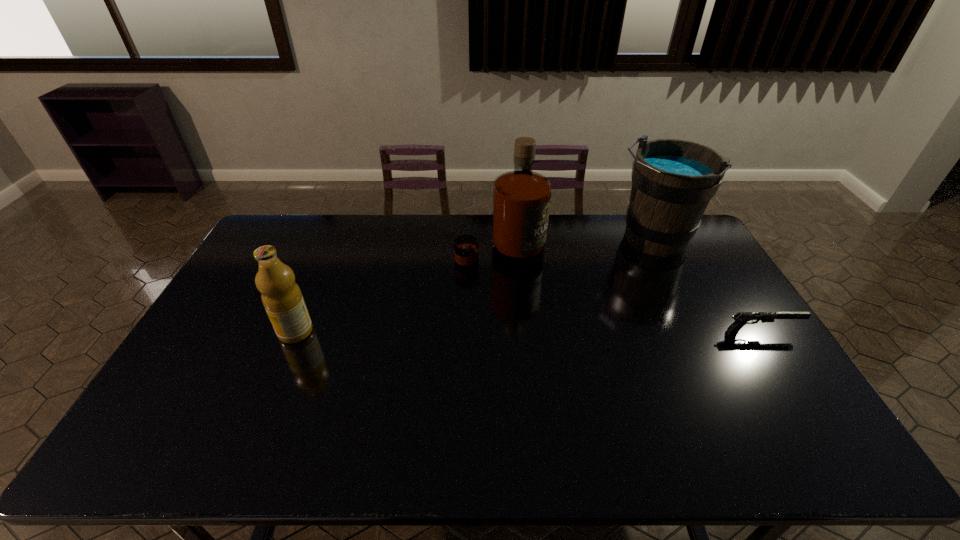
At what (x,y) coordinates should I click in order to perform the action: click on vacant space at the right edge of the desktop. Please return your answer as a coordinate pair (x, y). The image size is (960, 540). Looking at the image, I should click on (685, 284).

What are the coordinates of `vacant region at the far left corner` in the screenshot? It's located at (294, 224).

Find the location of a particular element. This screenshot has width=960, height=540. free space at the near left corner of the desktop is located at coordinates (199, 399).

Find the location of a particular element. vacant area that lies between the shortest object and the second object from left to right is located at coordinates (630, 292).

The height and width of the screenshot is (540, 960). I want to click on free area in between the shortest object and the second shortest object, so click(x=528, y=332).

The width and height of the screenshot is (960, 540). What are the coordinates of `free space between the gun and the liquor` in the screenshot? It's located at (630, 292).

Where is `free space between the gun and the third tallest object`? free space between the gun and the third tallest object is located at coordinates (528, 332).

Identify the location of unoccupied position between the second shortest object and the gun. This screenshot has height=540, width=960. (528, 332).

Find the location of a particular element. The image size is (960, 540). free space between the gun and the wine bucket is located at coordinates (707, 286).

At what (x,y) coordinates should I click in order to perform the action: click on unoccupied position between the second tallest object and the olive oil. Please return your answer as a coordinate pair (x, y). The image size is (960, 540). Looking at the image, I should click on (474, 286).